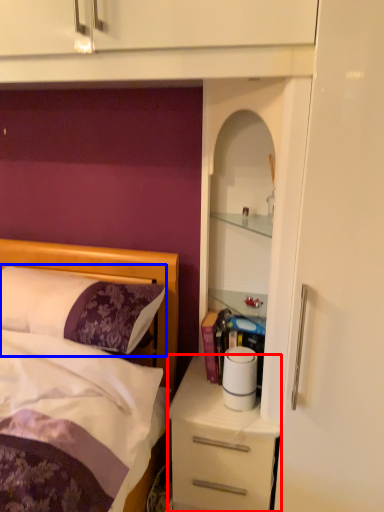
Question: Which object appears closest to the camera in this image, desk (highlighted by a red box) or pillow (highlighted by a blue box)?

Choices:
 (A) desk
 (B) pillow

Answer: (B)